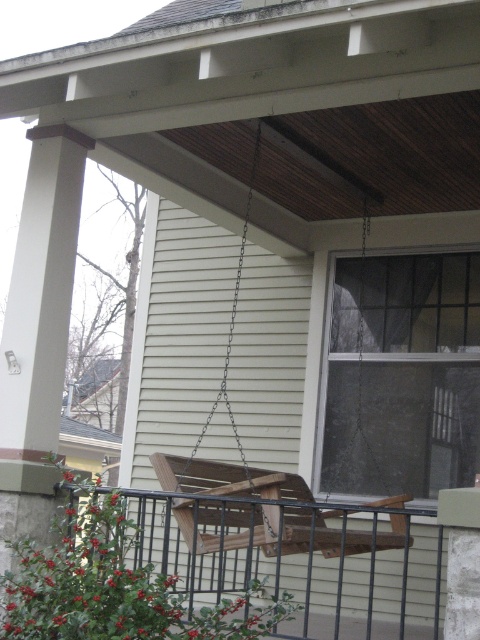
Question: Which object appears farthest from the camera in this image?

Choices:
 (A) brown wooden swing at center
 (B) wooden swing at center

Answer: (A)

Question: Does wooden swing at center appear under brown wooden swing at center?

Choices:
 (A) yes
 (B) no

Answer: (A)

Question: Can you confirm if wooden swing at center is wider than brown wooden swing at center?

Choices:
 (A) yes
 (B) no

Answer: (A)

Question: Is wooden swing at center to the right of brown wooden swing at center from the viewer's perspective?

Choices:
 (A) no
 (B) yes

Answer: (B)